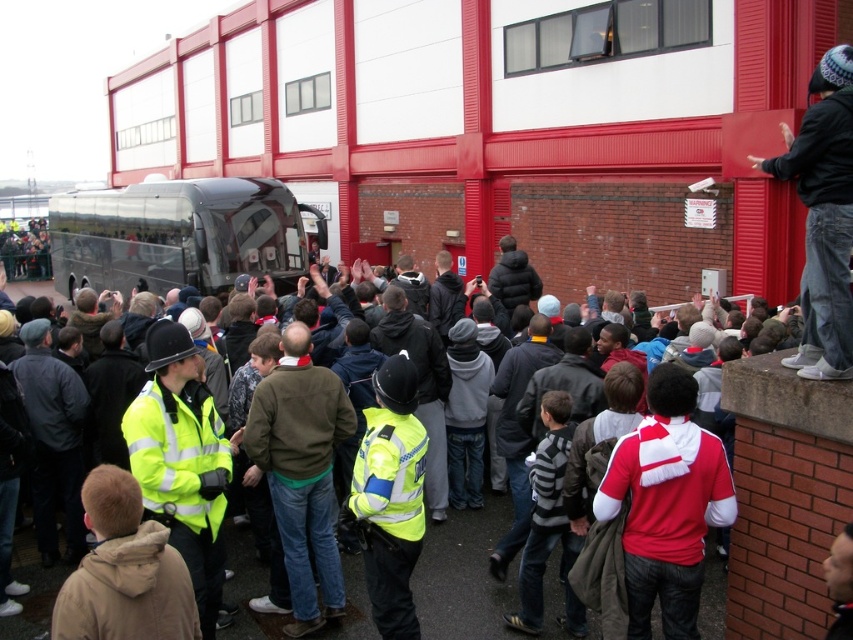
Which is above, shiny black bus at center or matte black bus at center?

shiny black bus at center is higher up.

What do you see at coordinates (178, 236) in the screenshot? The height and width of the screenshot is (640, 853). I see `shiny black bus at center` at bounding box center [178, 236].

Is point (271, 243) in front of point (436, 602)?

That is False.

Locate an element on the screen. shiny black bus at center is located at coordinates click(x=178, y=236).

Which of these two, matte black bus at center or red and white jersey at center, stands taller?

red and white jersey at center is taller.

Is matte black bus at center wider than red and white jersey at center?

Incorrect, matte black bus at center's width does not surpass red and white jersey at center's.

Identify the location of matte black bus at center. pos(463,577).

Can you confirm if shiny black bus at center is smaller than red and white jersey at center?

No, shiny black bus at center is not smaller than red and white jersey at center.

This screenshot has height=640, width=853. Find the location of `shiny black bus at center`. shiny black bus at center is located at coordinates (178, 236).

Is point (103, 273) farther from camera compared to point (670, 490)?

Yes, it is behind point (670, 490).

You are a GUI agent. You are given a task and a screenshot of the screen. Output one action in this format:
    pyautogui.click(x=<x>, y=<y>)
    Task: Click on the shiny black bus at center
    The image size is (853, 640).
    Given the screenshot: What is the action you would take?
    pyautogui.click(x=178, y=236)